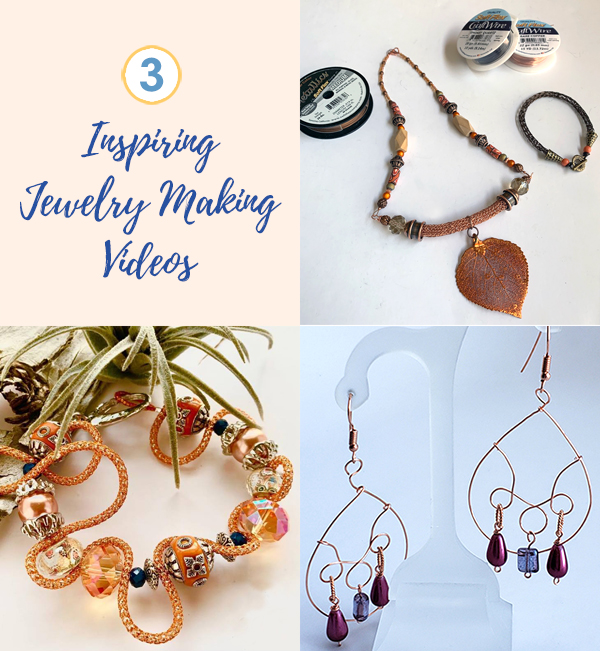
The image size is (600, 651). What are the coordinates of `leaf pendant` in the screenshot? It's located at click(x=492, y=275).